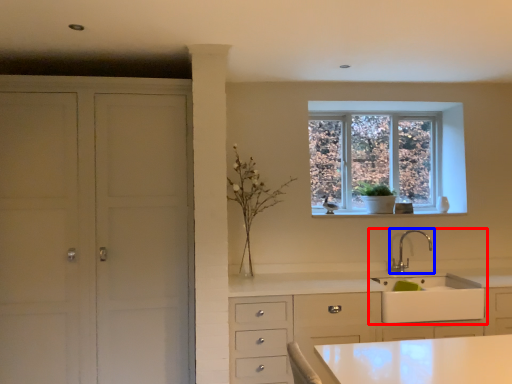
Question: Which object is further to the camera taking this photo, sink (highlighted by a red box) or tap (highlighted by a blue box)?

Choices:
 (A) sink
 (B) tap

Answer: (B)